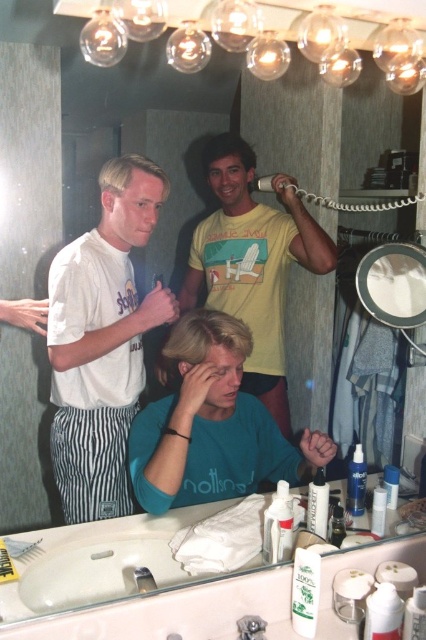
Which is above, teal matte shirt at center or yellow cotton shirt at upper center?

yellow cotton shirt at upper center

You are a GUI agent. You are given a task and a screenshot of the screen. Output one action in this format:
    pyautogui.click(x=<x>, y=<y>)
    Task: Click on the teal matte shirt at center
    The height and width of the screenshot is (640, 426).
    Given the screenshot: What is the action you would take?
    pyautogui.click(x=210, y=424)

Which is more to the right, yellow cotton shirt at upper center or dark brown hair at upper center?

yellow cotton shirt at upper center is more to the right.

Is point (256, 225) closer to camera compared to point (215, 160)?

No, it is behind (215, 160).

Image resolution: width=426 pixels, height=640 pixels. I want to click on yellow cotton shirt at upper center, so click(253, 262).

Does white cotton shirt at center have a greater width compared to teal matte shirt at center?

Incorrect, white cotton shirt at center's width does not surpass teal matte shirt at center's.

From the picture: Can you confirm if white cotton shirt at center is positioned above teal matte shirt at center?

Yes, white cotton shirt at center is above teal matte shirt at center.

At what (x,y) coordinates should I click in order to perform the action: click on white cotton shirt at center. Please return your answer as a coordinate pair (x, y). The height and width of the screenshot is (640, 426). Looking at the image, I should click on (101, 340).